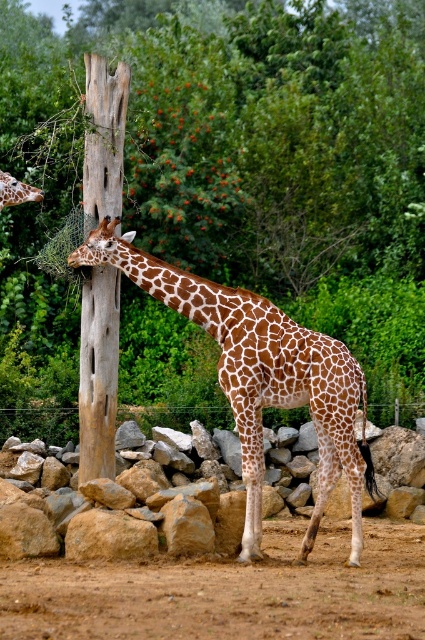
Question: Can you confirm if brown sandy soil at lower center is positioned above brown spotted giraffe at center?

Choices:
 (A) no
 (B) yes

Answer: (A)

Question: Which object appears closest to the camera in this image?

Choices:
 (A) brown sandy soil at lower center
 (B) brown spotted giraffe at center
 (C) brown textured wood at center

Answer: (A)

Question: Considering the relative positions of brown rough wood at center and brown spotted giraffe at left in the image provided, where is brown rough wood at center located with respect to brown spotted giraffe at left?

Choices:
 (A) below
 (B) above

Answer: (B)

Question: Estimate the real-world distances between objects in this image. Which object is closer to the brown spotted giraffe at center?

Choices:
 (A) brown textured wood at center
 (B) brown rough wood at center

Answer: (A)

Question: Which of the following is the closest to the observer?

Choices:
 (A) brown sandy soil at lower center
 (B) brown textured wood at center

Answer: (A)

Question: Can you confirm if brown spotted giraffe at left is positioned above brown textured wood at center?

Choices:
 (A) yes
 (B) no

Answer: (A)